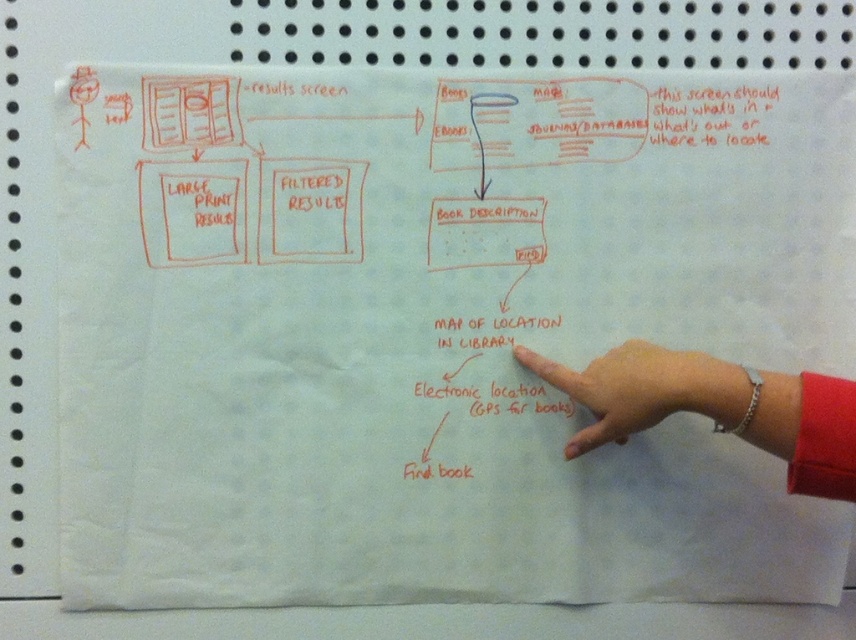
You are analyzing the flowchart and want to determine the order of the points. Which point is closer to the viewer, point at coordinates (770, 385) or point at (661, 410)?

Point at coordinates (770, 385) is in front of point at (661, 410), so it is closer to the viewer.

You are a librarian organizing items on a shelf. You have a silver bracelet at lower right and a matte red book description at center. Which item should you place on the left side of the shelf if you want to ensure the wider item is on the right?

The silver bracelet at lower right might be wider than the matte red book description at center, so place the silver bracelet at lower right on the right side and the matte red book description at center on the left.